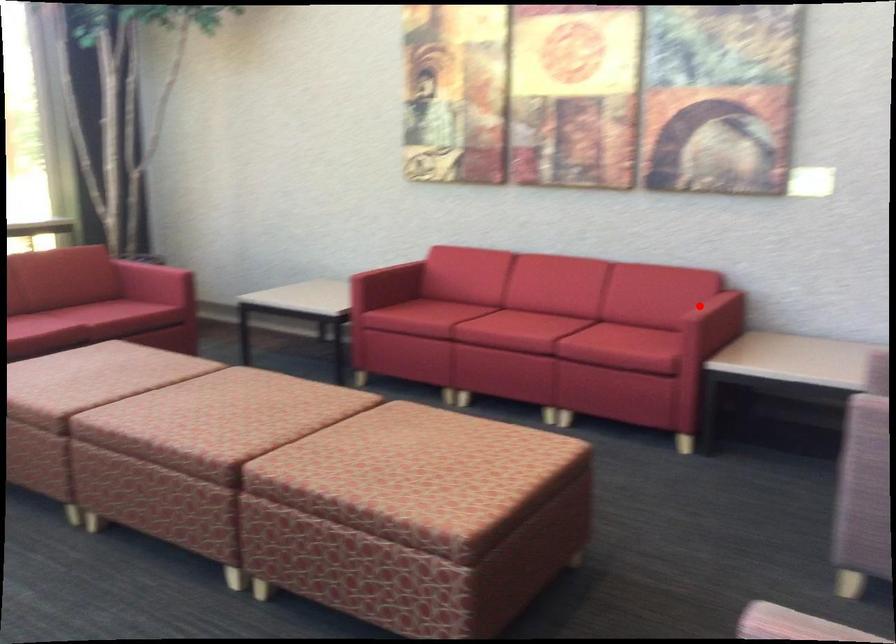
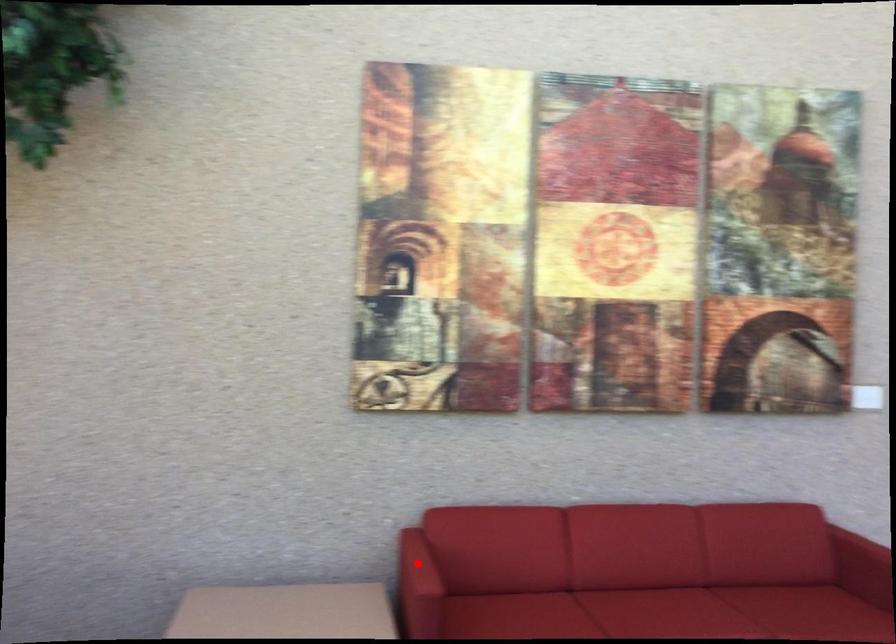
I am providing you with two images of the same scene from different viewpoints. A red point is marked on the first image and another point is marked on the second image. Are the points marked in image1 and image2 representing the same 3D position?

No